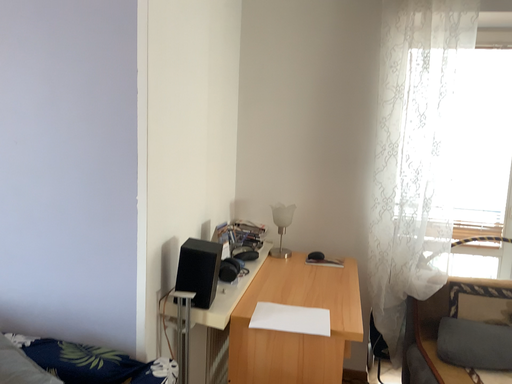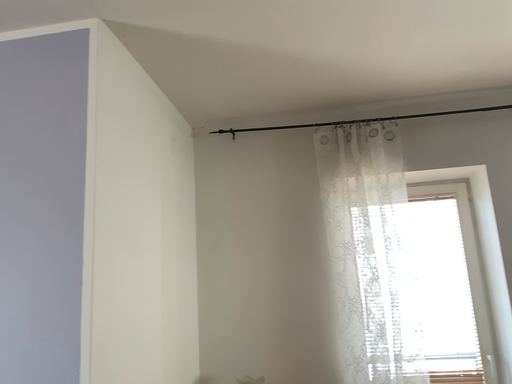
Question: How did the camera likely rotate when shooting the video?

Choices:
 (A) rotated upward
 (B) rotated downward

Answer: (A)